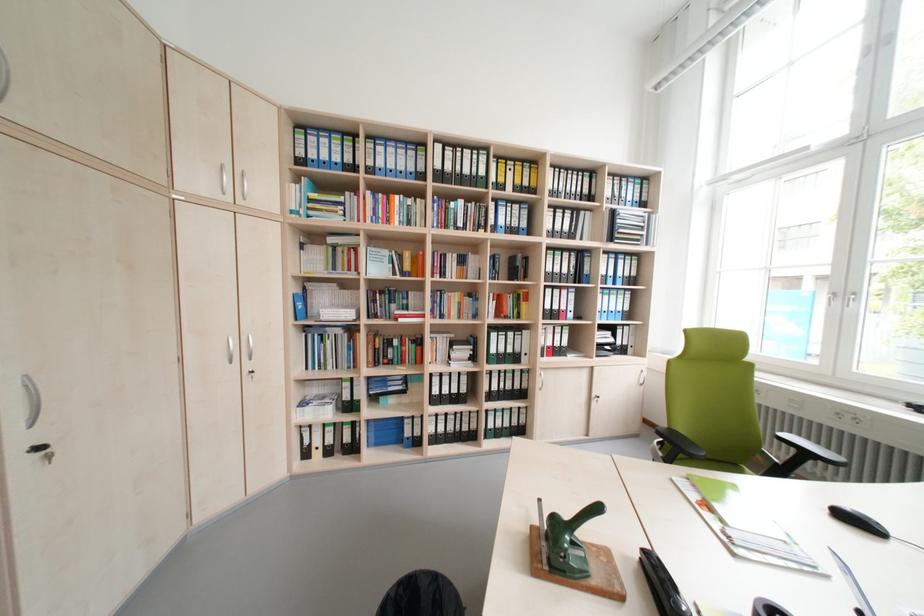
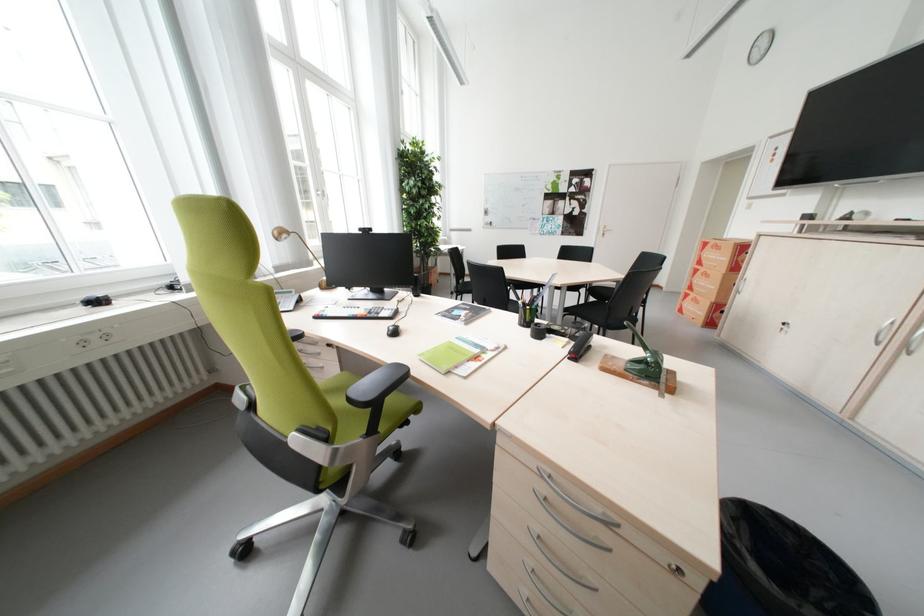
Locate, in the second image, the point that corresponds to point 859,416 in the first image.

(104, 339)